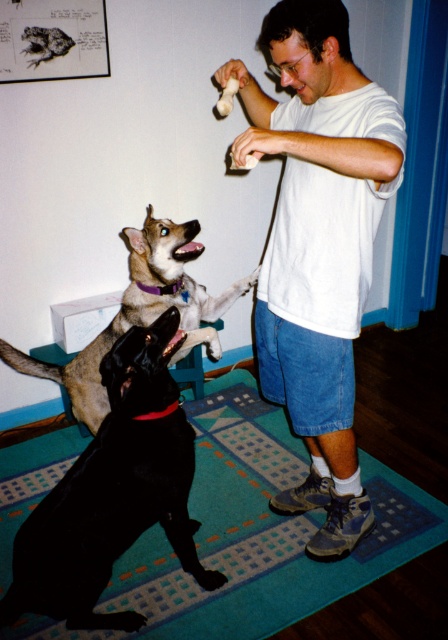
Question: Which object is farther from the camera taking this photo?

Choices:
 (A) white cotton shirt at center
 (B) light brown fur at center
 (C) teal carpet at lower center
 (D) black glossy dog at lower left

Answer: (B)

Question: Which point is farther from the camera taking this photo?

Choices:
 (A) (321, 417)
 (B) (391, 536)

Answer: (B)

Question: Is white cotton shirt at center to the right of teal carpet at lower center from the viewer's perspective?

Choices:
 (A) yes
 (B) no

Answer: (A)

Question: Can you confirm if white cotton shirt at center is wider than light brown fur at center?

Choices:
 (A) no
 (B) yes

Answer: (A)

Question: Which object appears farthest from the camera in this image?

Choices:
 (A) white cotton shirt at center
 (B) teal carpet at lower center
 (C) black glossy dog at lower left

Answer: (B)

Question: Is teal carpet at lower center bigger than light brown fur at center?

Choices:
 (A) no
 (B) yes

Answer: (B)